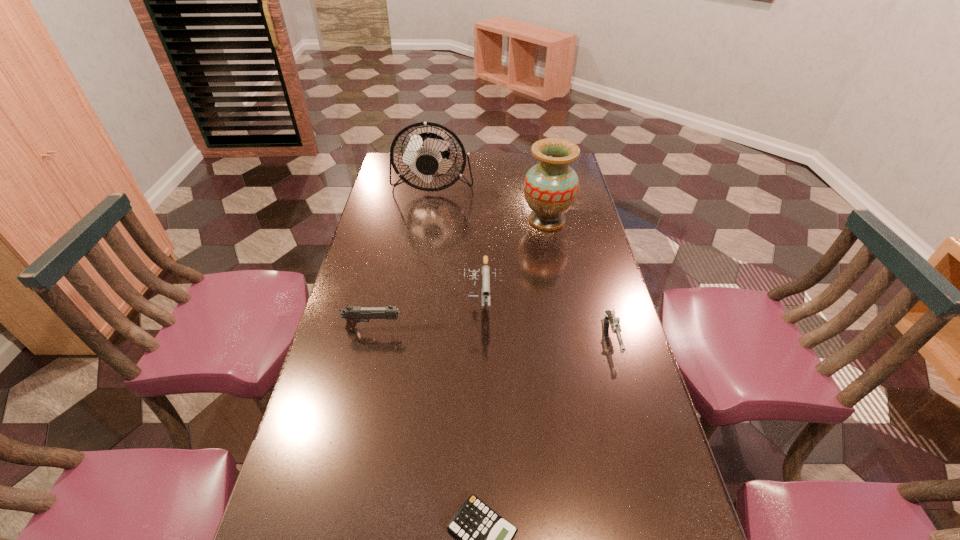
Where is `fan`? The width and height of the screenshot is (960, 540). fan is located at coordinates (425, 154).

The image size is (960, 540). In order to click on the fifth object from left to right in this screenshot , I will do `click(551, 187)`.

The width and height of the screenshot is (960, 540). Find the location of `vase`. vase is located at coordinates (551, 187).

This screenshot has height=540, width=960. In order to click on the tallest gun in this screenshot , I will do `click(485, 268)`.

Image resolution: width=960 pixels, height=540 pixels. I want to click on the second gun from left to right, so click(x=485, y=268).

Find the location of a particular element. The image size is (960, 540). the leftmost gun is located at coordinates (353, 314).

Find the location of `the second tallest gun`. the second tallest gun is located at coordinates (353, 314).

Identify the location of the fifth tallest object. (614, 321).

Image resolution: width=960 pixels, height=540 pixels. In order to click on the shortest gun in this screenshot , I will do `click(614, 321)`.

Image resolution: width=960 pixels, height=540 pixels. I want to click on free space located 0.310m in front of the farthest object, directing airflow, so click(422, 252).